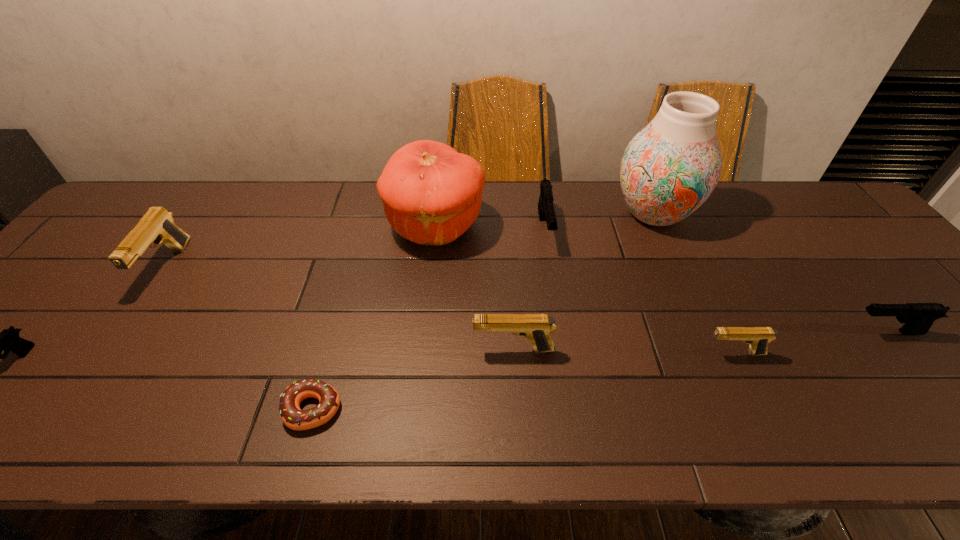
Where is `tan pistol that is the closest to the leftmost tan pistol`? This screenshot has height=540, width=960. tan pistol that is the closest to the leftmost tan pistol is located at coordinates (536, 327).

Locate which black pistol ranks in proximity to the second tallest object. Please provide its 2D coordinates. Your answer should be formatted as a tuple, i.e. [(x, y)], where the tuple contains the x and y coordinates of a point satisfying the conditions above.

[(546, 211)]

Select which black pistol is the second closest to the third farthest pistol. Please provide its 2D coordinates. Your answer should be formatted as a tuple, i.e. [(x, y)], where the tuple contains the x and y coordinates of a point satisfying the conditions above.

[(8, 340)]